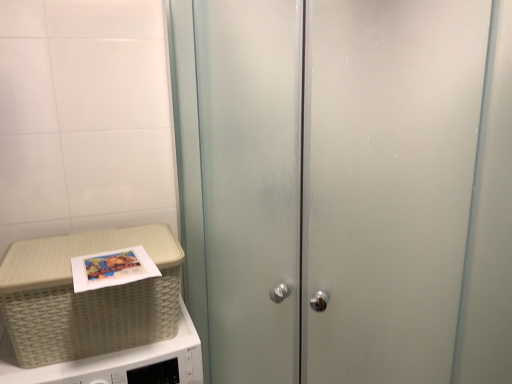
Question: Does frosted glass cabinet at center appear on the right side of beige woven picnic basket at lower left?

Choices:
 (A) yes
 (B) no

Answer: (A)

Question: Is frosted glass cabinet at center smaller than beige woven picnic basket at lower left?

Choices:
 (A) no
 (B) yes

Answer: (A)

Question: From the image's perspective, is frosted glass cabinet at center below beige woven picnic basket at lower left?

Choices:
 (A) no
 (B) yes

Answer: (A)

Question: Considering the relative positions of frosted glass cabinet at center and beige woven picnic basket at lower left in the image provided, is frosted glass cabinet at center behind beige woven picnic basket at lower left?

Choices:
 (A) yes
 (B) no

Answer: (B)

Question: Is frosted glass cabinet at center facing towards beige woven picnic basket at lower left?

Choices:
 (A) no
 (B) yes

Answer: (A)

Question: Does frosted glass cabinet at center have a lesser width compared to beige woven picnic basket at lower left?

Choices:
 (A) yes
 (B) no

Answer: (B)

Question: Is beige woven picnic basket at lower left placed right next to white woven basket at left?

Choices:
 (A) yes
 (B) no

Answer: (B)

Question: Is beige woven picnic basket at lower left at the left side of white woven basket at left?

Choices:
 (A) no
 (B) yes

Answer: (A)

Question: Is the position of beige woven picnic basket at lower left more distant than that of white woven basket at left?

Choices:
 (A) yes
 (B) no

Answer: (A)

Question: Considering the relative sizes of beige woven picnic basket at lower left and white woven basket at left in the image provided, is beige woven picnic basket at lower left thinner than white woven basket at left?

Choices:
 (A) no
 (B) yes

Answer: (B)

Question: Would you say beige woven picnic basket at lower left is a long distance from white woven basket at left?

Choices:
 (A) no
 (B) yes

Answer: (A)

Question: Is the depth of beige woven picnic basket at lower left less than that of white woven basket at left?

Choices:
 (A) no
 (B) yes

Answer: (A)

Question: Is beige woven picnic basket at lower left positioned with its back to frosted glass cabinet at center?

Choices:
 (A) yes
 (B) no

Answer: (B)